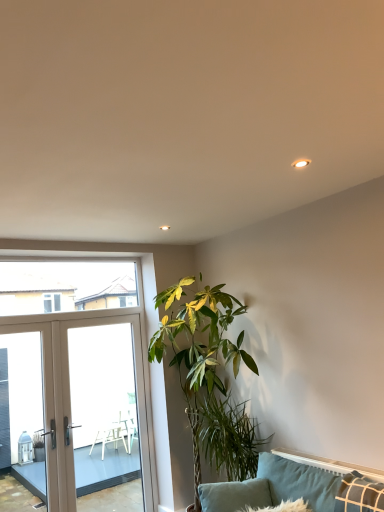
Question: From the image's perspective, is velvet teal pillow at lower right below beige glass door at left?

Choices:
 (A) no
 (B) yes

Answer: (B)

Question: Does velvet teal pillow at lower right have a larger size compared to beige glass door at left?

Choices:
 (A) no
 (B) yes

Answer: (A)

Question: Can beige glass door at left be found inside velvet teal pillow at lower right?

Choices:
 (A) yes
 (B) no

Answer: (B)

Question: Does velvet teal pillow at lower right appear on the right side of beige glass door at left?

Choices:
 (A) no
 (B) yes

Answer: (B)

Question: Can you confirm if velvet teal pillow at lower right is wider than beige glass door at left?

Choices:
 (A) no
 (B) yes

Answer: (B)

Question: Do you think transparent glass window at upper left is within green leafy plant at lower center, or outside of it?

Choices:
 (A) outside
 (B) inside

Answer: (A)

Question: In the image, is transparent glass window at upper left positioned in front of or behind green leafy plant at lower center?

Choices:
 (A) behind
 (B) front

Answer: (A)

Question: In the image, is transparent glass window at upper left on the left side or the right side of green leafy plant at lower center?

Choices:
 (A) right
 (B) left

Answer: (B)

Question: In terms of width, does transparent glass window at upper left look wider or thinner when compared to green leafy plant at lower center?

Choices:
 (A) wide
 (B) thin

Answer: (B)

Question: From a real-world perspective, is white glossy screen door at left above or below velvet teal pillow at lower right?

Choices:
 (A) below
 (B) above

Answer: (B)

Question: Looking at their shapes, would you say white glossy screen door at left is wider or thinner than velvet teal pillow at lower right?

Choices:
 (A) thin
 (B) wide

Answer: (A)

Question: Considering their positions, is white glossy screen door at left located in front of or behind velvet teal pillow at lower right?

Choices:
 (A) front
 (B) behind

Answer: (B)

Question: From the image's perspective, is white glossy screen door at left positioned above or below velvet teal pillow at lower right?

Choices:
 (A) below
 (B) above

Answer: (A)

Question: In the image, is green leafy plant at center on the left side or the right side of transparent glass window at upper left?

Choices:
 (A) right
 (B) left

Answer: (A)

Question: In terms of width, does green leafy plant at center look wider or thinner when compared to transparent glass window at upper left?

Choices:
 (A) thin
 (B) wide

Answer: (B)